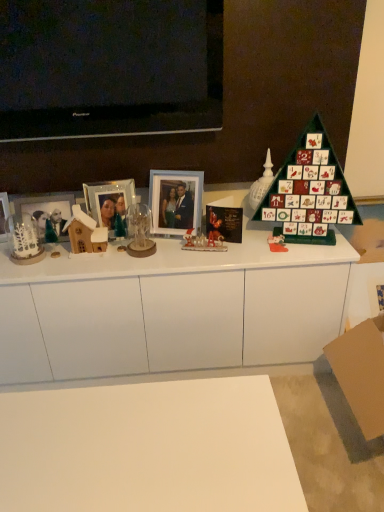
Find the location of a particular element. The height and width of the screenshot is (512, 384). vacant area on top of white matte desk at lower center (from a real-world perspective) is located at coordinates (x=133, y=436).